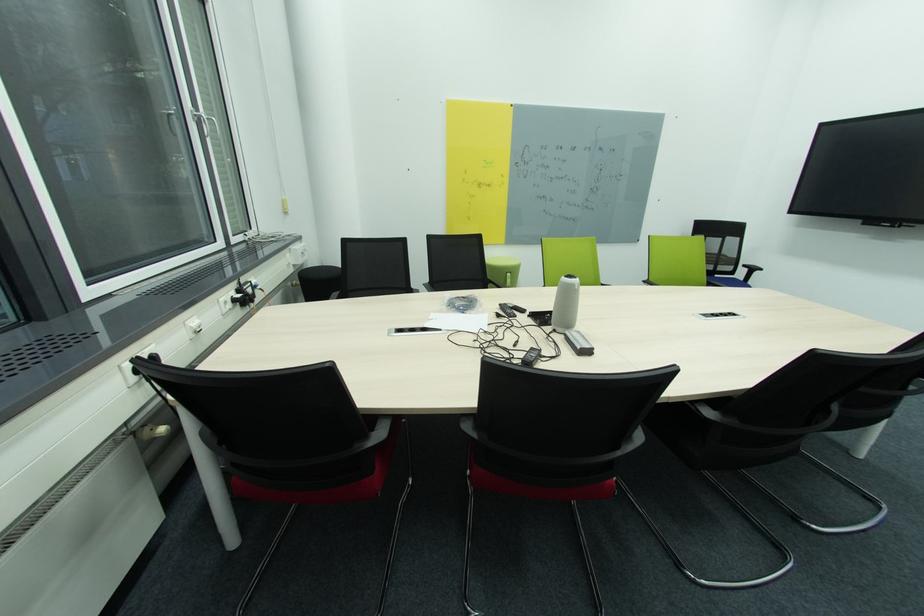
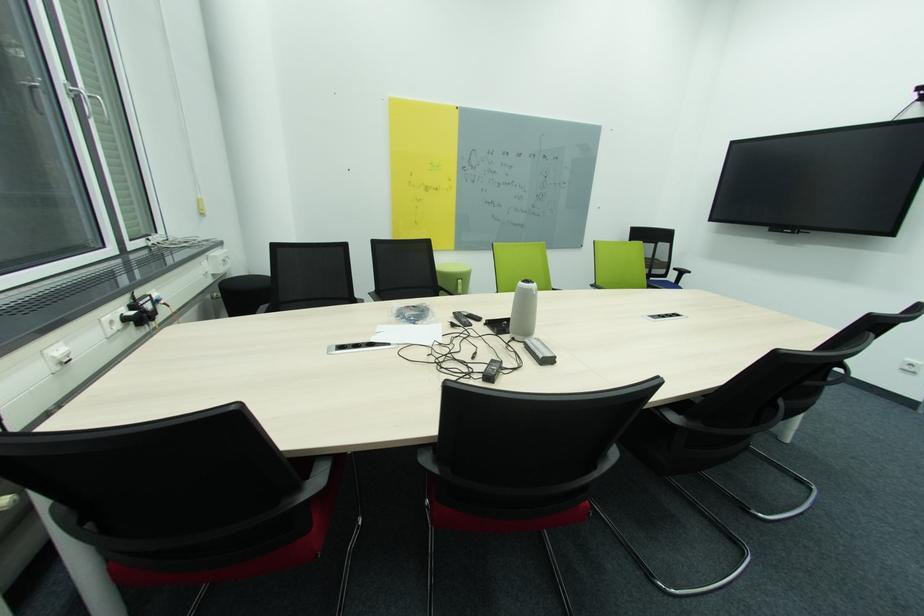
Where in the second image is the point corresponding to point 505,306 from the first image?

(458, 314)